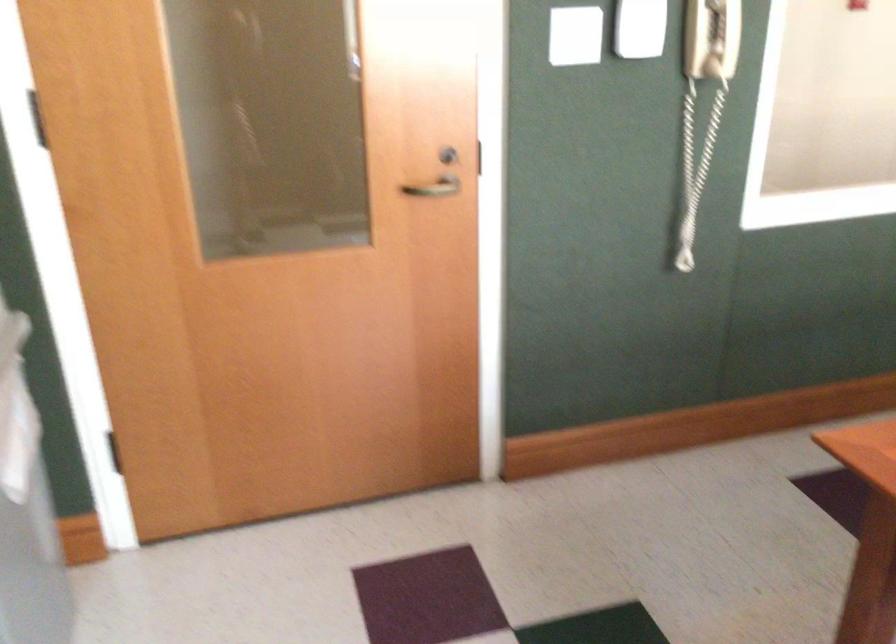
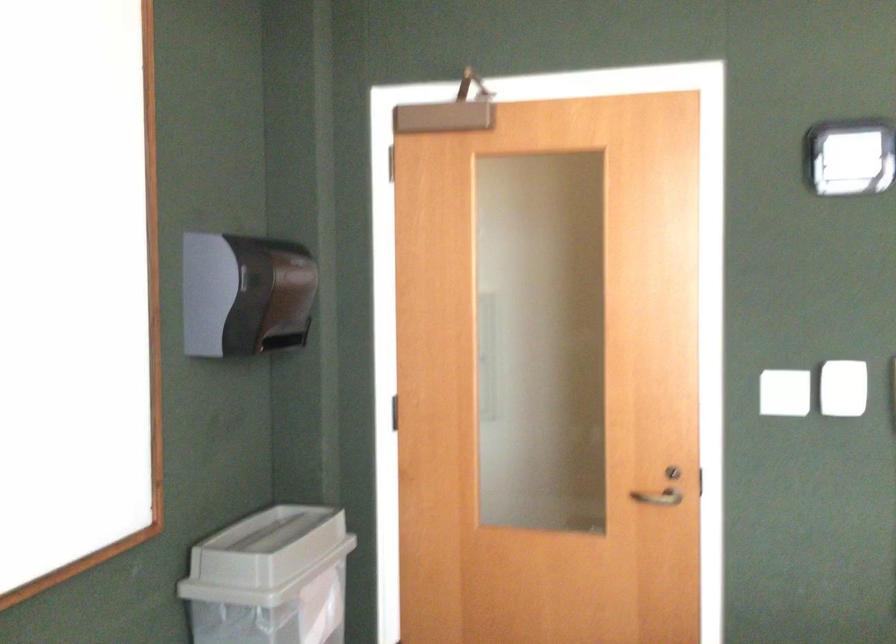
The first image is from the beginning of the video and the second image is from the end. How did the camera likely rotate when shooting the video?

The camera rotated toward left-up.